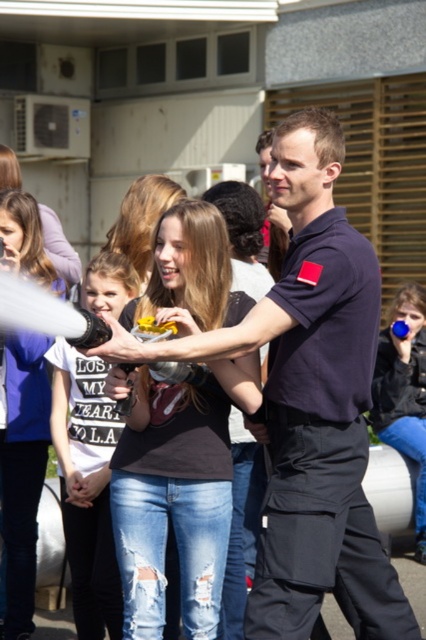
Question: Which object is closer to the camera taking this photo?

Choices:
 (A) dark blue uniform at center
 (B) matte black hair at center

Answer: (A)

Question: Which object is the farthest from the matte black hair at center?

Choices:
 (A) white cotton shirt at center
 (B) blue matte cup at lower right
 (C) ripped denim jeans at center
 (D) denim jeans at center

Answer: (B)

Question: Is dark blue uniform at center above matte black shirt at center?

Choices:
 (A) yes
 (B) no

Answer: (B)

Question: Does dark blue uniform at center appear on the left side of matte black hair at center?

Choices:
 (A) yes
 (B) no

Answer: (B)

Question: Considering the real-world distances, which object is closest to the ripped denim jeans at center?

Choices:
 (A) dark blue uniform at center
 (B) blue matte cup at lower right

Answer: (A)

Question: Is blue matte cup at lower right bigger than matte black shirt at center?

Choices:
 (A) no
 (B) yes

Answer: (B)